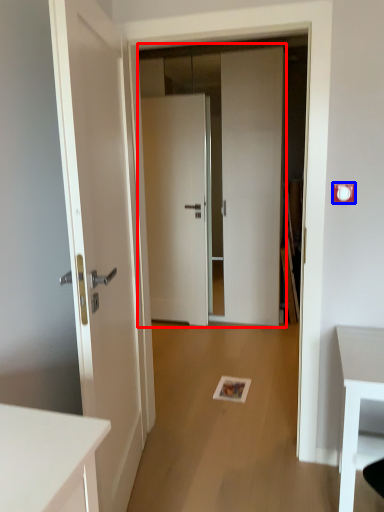
Question: Which object appears closest to the camera in this image, door (highlighted by a red box) or electric outlet (highlighted by a blue box)?

Choices:
 (A) door
 (B) electric outlet

Answer: (B)